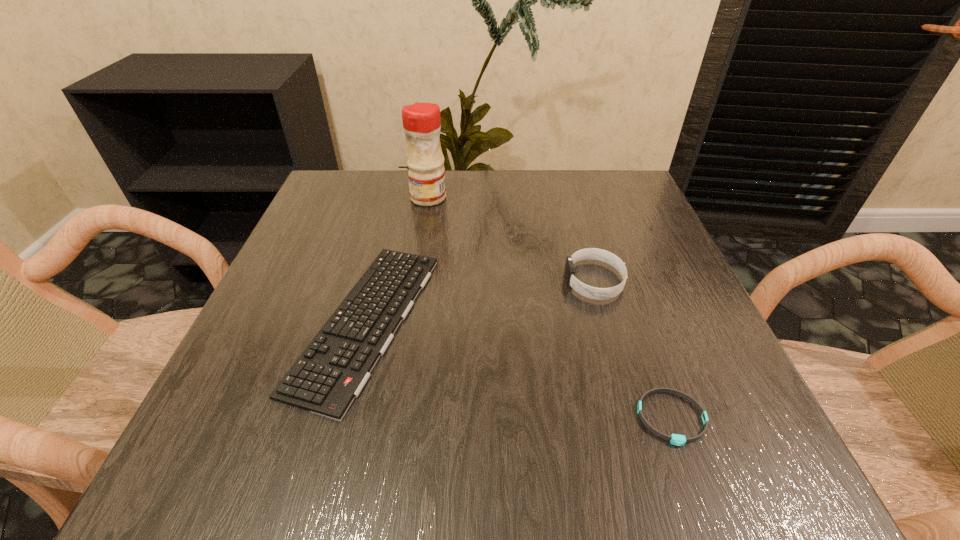
This screenshot has height=540, width=960. Find the location of `the farthest object`. the farthest object is located at coordinates (421, 121).

Image resolution: width=960 pixels, height=540 pixels. I want to click on the tallest object, so click(421, 121).

The height and width of the screenshot is (540, 960). What are the coordinates of `the farther wristband` in the screenshot? It's located at (595, 293).

You are a GUI agent. You are given a task and a screenshot of the screen. Output one action in this format:
    pyautogui.click(x=<x>, y=<y>)
    Task: Click on the second tallest object
    This screenshot has width=960, height=540.
    Given the screenshot: What is the action you would take?
    pyautogui.click(x=595, y=293)

The width and height of the screenshot is (960, 540). Identify the location of the third tallest object. click(331, 372).

You are a GUI agent. You are given a task and a screenshot of the screen. Output one action in this format:
    pyautogui.click(x=<x>, y=<y>)
    Task: Click on the nearer wristband
    This screenshot has width=960, height=540.
    Given the screenshot: What is the action you would take?
    pyautogui.click(x=679, y=440)

Locate an element on the screen. the shortest object is located at coordinates (679, 440).

Image resolution: width=960 pixels, height=540 pixels. Find the location of `vacant space located on the left of the condiment`. vacant space located on the left of the condiment is located at coordinates (352, 198).

Where is `free region located 0.240m on the outer surface of the farther wristband`? Image resolution: width=960 pixels, height=540 pixels. free region located 0.240m on the outer surface of the farther wristband is located at coordinates (439, 281).

Find the location of a particular element. vacant space positioned on the outer surface of the farther wristband is located at coordinates (419, 281).